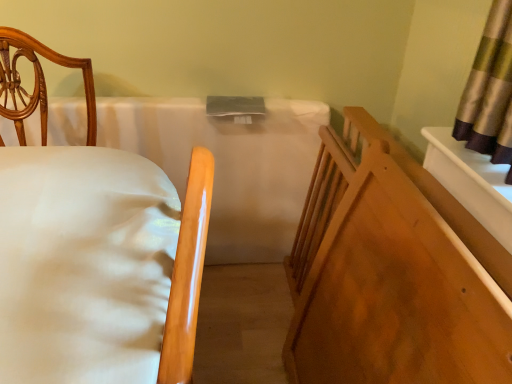
Where is `white fabric bed at left`? white fabric bed at left is located at coordinates (93, 249).

At what (x,y) coordinates should I click in order to perform the action: click on white smooth mattress at center. Please return your answer as a coordinate pair (x, y). Looking at the image, I should click on pos(228,165).

Could you tell me if white fabric bed at left is facing white smooth mattress at center?

No, white fabric bed at left does not turn towards white smooth mattress at center.

Are white fabric bed at left and white smooth mattress at center making contact?

No, white fabric bed at left is not in contact with white smooth mattress at center.

Consider the image. Who is taller, white fabric bed at left or white smooth mattress at center?

With more height is white smooth mattress at center.

Is white fabric bed at left wider or thinner than white smooth mattress at center?

In the image, white fabric bed at left appears to be wider than white smooth mattress at center.

Can you tell me how much white smooth mattress at center and white fabric bed at left differ in facing direction?

They differ by 92.9 degrees in their facing directions.

Does white smooth mattress at center come behind white fabric bed at left?

Yes, it is.

Between white smooth mattress at center and white fabric bed at left, which one appears on the left side from the viewer's perspective?

white smooth mattress at center is more to the left.

Considering the sizes of white smooth mattress at center and white fabric bed at left in the image, is white smooth mattress at center bigger or smaller than white fabric bed at left?

Clearly, white smooth mattress at center is smaller in size than white fabric bed at left.

Considering the relative sizes of white fabric bed at left and smooth wood crib at right in the image provided, is white fabric bed at left taller than smooth wood crib at right?

Correct, white fabric bed at left is much taller as smooth wood crib at right.

Would you say smooth wood crib at right is part of white fabric bed at left's contents?

That's incorrect, smooth wood crib at right is not inside white fabric bed at left.

From the image's perspective, which is below, white fabric bed at left or smooth wood crib at right?

white fabric bed at left appears lower in the image.

Locate an element on the screen. furniture that appears behind the white fabric bed at left is located at coordinates point(399,278).

Between smooth wood crib at right and white fabric bed at left, which one has smaller size?

smooth wood crib at right.

Is smooth wood crib at right positioned with its back to white fabric bed at left?

That's not correct — smooth wood crib at right is not looking away from white fabric bed at left.

Locate an element on the screen. bed on the left of smooth wood crib at right is located at coordinates (93, 249).

From the image's perspective, which is below, smooth wood crib at right or white fabric bed at left?

white fabric bed at left.

Relative to smooth wood crib at right, is white smooth mattress at center in front or behind?

Clearly, white smooth mattress at center is behind smooth wood crib at right.

Is white smooth mattress at center looking in the opposite direction of smooth wood crib at right?

No, smooth wood crib at right is not at the back of white smooth mattress at center.

Between smooth wood crib at right and white smooth mattress at center, which one has smaller width?

white smooth mattress at center.

In the image, is smooth wood crib at right positioned in front of or behind white smooth mattress at center?

smooth wood crib at right is positioned closer to the viewer than white smooth mattress at center.

The height and width of the screenshot is (384, 512). What are the coordinates of `mattress located behind the smooth wood crib at right` in the screenshot? It's located at (228, 165).

Between point (343, 306) and point (198, 106), which one is positioned behind?

The point (198, 106) is more distant.

You are a GUI agent. You are given a task and a screenshot of the screen. Output one action in this format:
    pyautogui.click(x=<x>, y=<y>)
    Task: Click on the mattress behind the white fabric bed at left
    
    Given the screenshot: What is the action you would take?
    (228, 165)

The height and width of the screenshot is (384, 512). Identify the location of bed on the right side of white smooth mattress at center. (93, 249).

In the scene shown: When comparing their distances from smooth wood crib at right, does white fabric bed at left or white smooth mattress at center seem closer?

Among the two, white fabric bed at left is located nearer to smooth wood crib at right.

Looking at the image, which one is located further to white fabric bed at left, white smooth mattress at center or smooth wood crib at right?

Based on the image, white smooth mattress at center appears to be further to white fabric bed at left.

Considering their positions, is white fabric bed at left positioned closer to white smooth mattress at center than smooth wood crib at right?

smooth wood crib at right.

Looking at this image, when comparing their distances from smooth wood crib at right, does white smooth mattress at center or white fabric bed at left seem closer?

Based on the image, white fabric bed at left appears to be nearer to smooth wood crib at right.

Which object lies further to the anchor point white fabric bed at left, smooth wood crib at right or white smooth mattress at center?

Based on the image, white smooth mattress at center appears to be further to white fabric bed at left.

From the picture: Which object lies further to the anchor point white smooth mattress at center, smooth wood crib at right or white fabric bed at left?

white fabric bed at left lies further to white smooth mattress at center than the other object.

Where is `furniture between white fabric bed at left and white smooth mattress at center along the z-axis`? The width and height of the screenshot is (512, 384). furniture between white fabric bed at left and white smooth mattress at center along the z-axis is located at coordinates (399, 278).